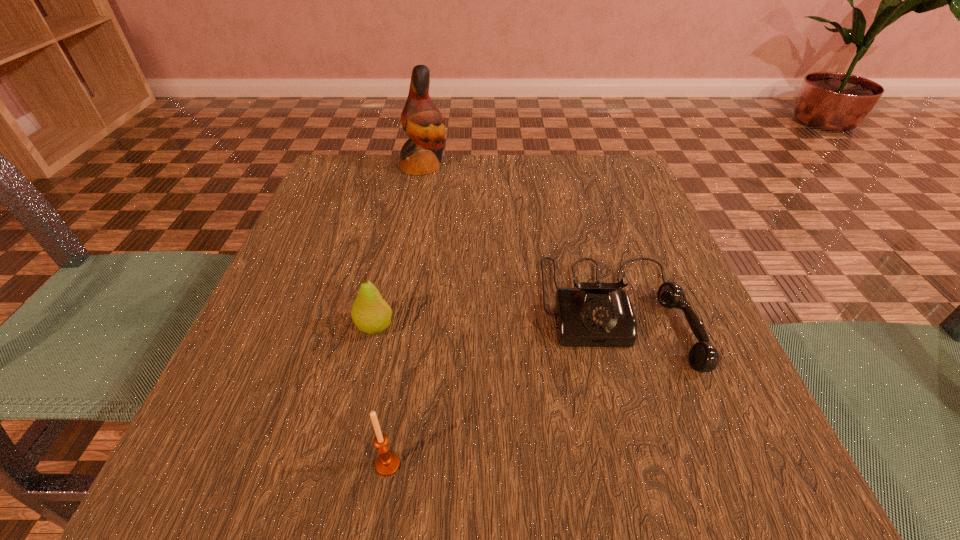
Find the location of a particular element. This screenshot has height=540, width=960. the tallest object is located at coordinates (421, 120).

You are a GUI agent. You are given a task and a screenshot of the screen. Output one action in this format:
    pyautogui.click(x=<x>, y=<y>)
    Task: Click on the parrot
    
    Given the screenshot: What is the action you would take?
    pyautogui.click(x=421, y=120)

Find the location of `candle_holder`. candle_holder is located at coordinates (387, 463).

The height and width of the screenshot is (540, 960). I want to click on pear, so click(371, 314).

Identify the location of the rightmost object. (598, 314).

Where is `the shortest object`? Image resolution: width=960 pixels, height=540 pixels. the shortest object is located at coordinates (598, 314).

Where is `vacant space located 0.290m on the face of the parrot`? vacant space located 0.290m on the face of the parrot is located at coordinates (564, 166).

This screenshot has height=540, width=960. In order to click on free spot located on the left of the nearest object in this screenshot , I will do `click(230, 464)`.

Identify the location of vacant space located on the right of the pear. The width and height of the screenshot is (960, 540). (630, 327).

At what (x,y) coordinates should I click in order to perform the action: click on vacant space located on the dial of the shortest object. Please return your answer as a coordinate pair (x, y). This screenshot has width=960, height=540. Looking at the image, I should click on (646, 412).